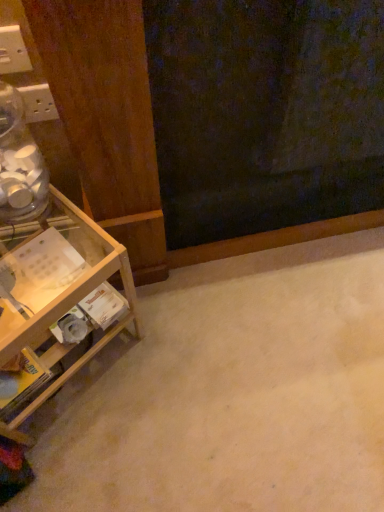
The height and width of the screenshot is (512, 384). In order to click on free space in front of wooden shelf at left in this screenshot , I will do `click(92, 459)`.